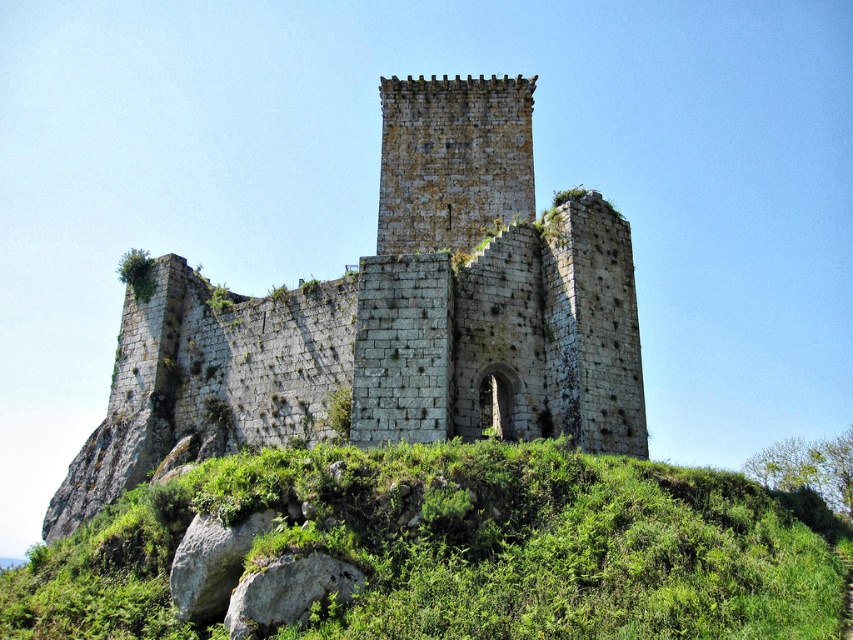
Does rusty stone ruins at center have a larger size compared to green grassy at center?

Correct, rusty stone ruins at center is larger in size than green grassy at center.

Is rusty stone ruins at center to the right of green grassy at center from the viewer's perspective?

In fact, rusty stone ruins at center is to the left of green grassy at center.

Which is behind, point (548, 289) or point (535, 528)?

The point (548, 289) is behind.

Find the location of a particular element. Image resolution: width=853 pixels, height=640 pixels. rusty stone ruins at center is located at coordinates (393, 317).